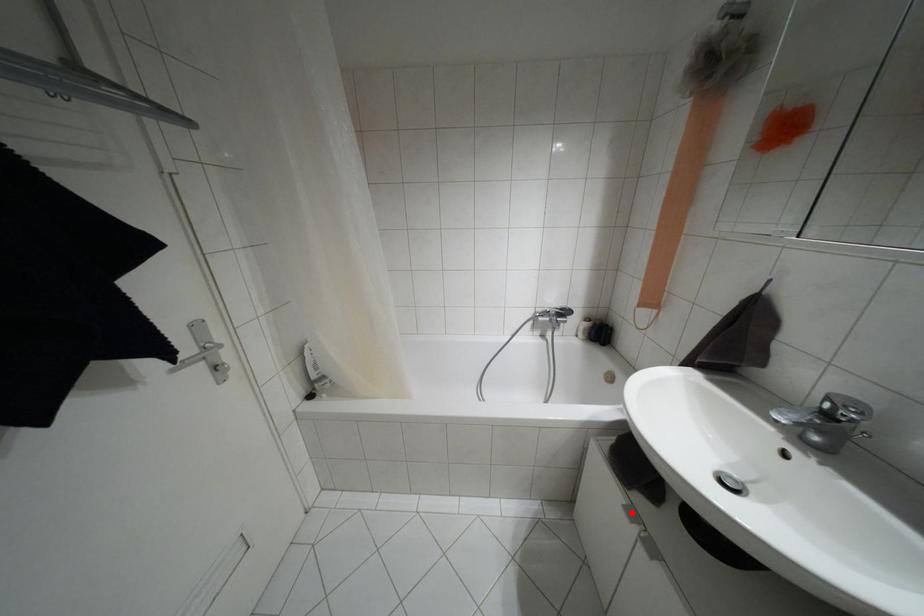
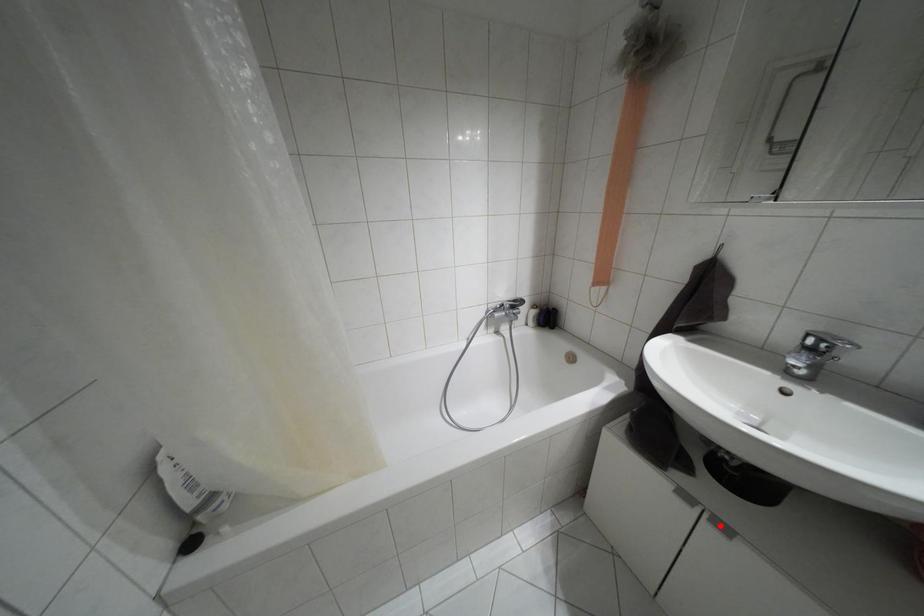
I am providing you with two images of the same scene from different viewpoints. A red point is marked on the first image and another point is marked on the second image. Is the marked point in image1 the same physical position as the marked point in image2?

No